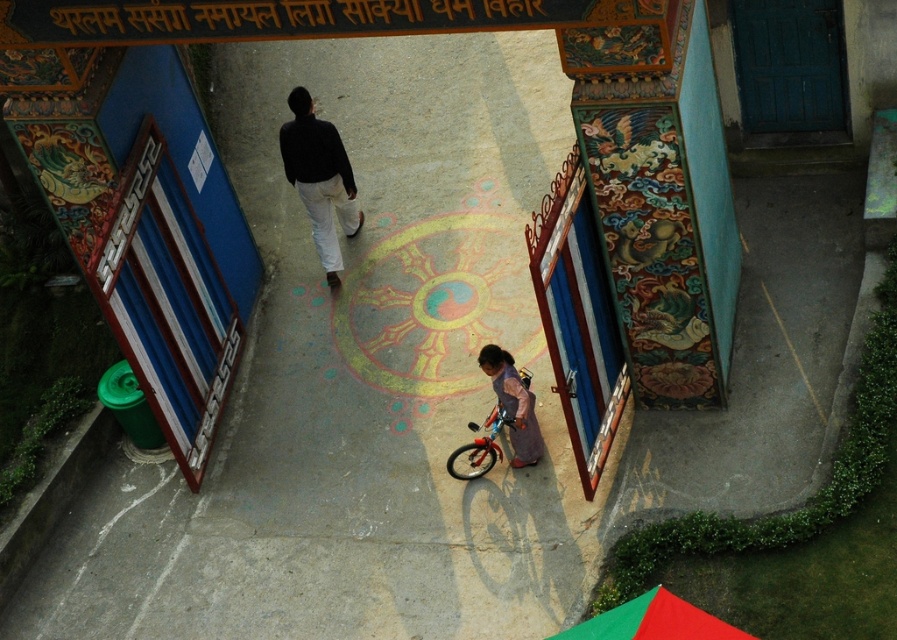
Question: Which point is closer to the camera?

Choices:
 (A) metallic silver bicycle at center
 (B) pink fabric at center
 (C) wooden door at center
 (D) blue painted door at upper right

Answer: (C)

Question: Which is farther from the wooden door at center?

Choices:
 (A) pink fabric at center
 (B) blue painted door at upper right
 (C) black matte sweater at center
 (D) metallic silver bicycle at center

Answer: (B)

Question: In this image, where is wooden door at center located relative to pink fabric at center?

Choices:
 (A) right
 (B) left

Answer: (A)

Question: Does wooden door at center have a greater width compared to pink fabric at center?

Choices:
 (A) no
 (B) yes

Answer: (B)

Question: Which is nearer to the blue painted door at upper right?

Choices:
 (A) metallic silver bicycle at center
 (B) wooden door at center
 (C) black matte sweater at center
 (D) pink fabric at center

Answer: (B)

Question: Is black matte sweater at center closer to the viewer compared to pink fabric at center?

Choices:
 (A) yes
 (B) no

Answer: (B)